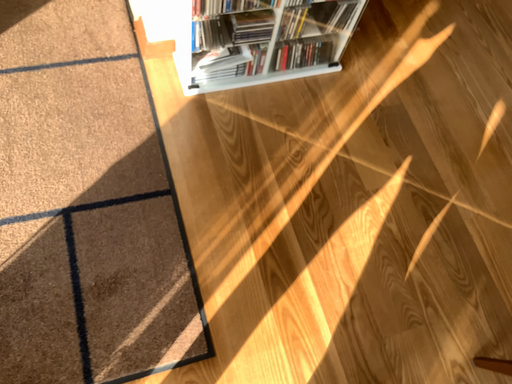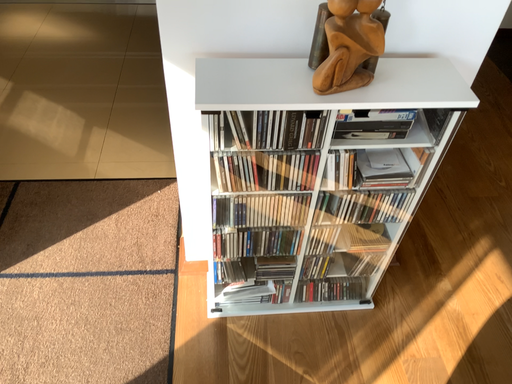
Question: Which way did the camera rotate in the video?

Choices:
 (A) rotated left
 (B) rotated right

Answer: (A)